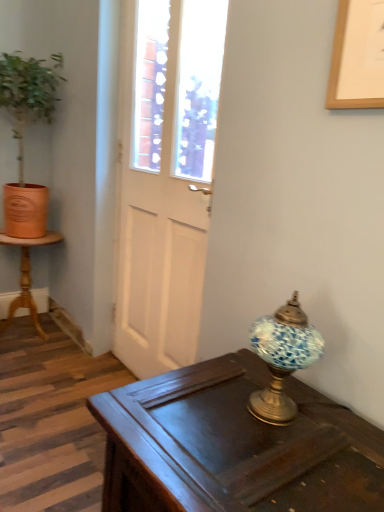
Locate an element on the screen. The image size is (384, 512). vacant area that lies between wooden pedestal table at left and white glossy door at center is located at coordinates (77, 360).